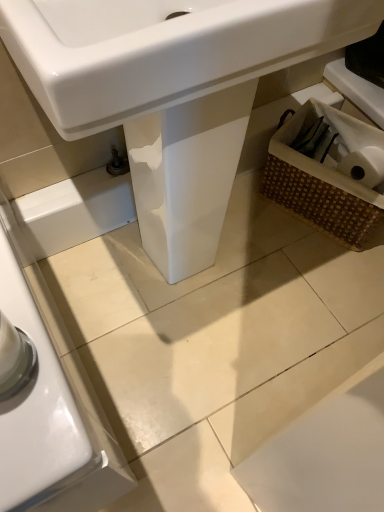
Where is `vacant space to the right of white glossy sink at center`? vacant space to the right of white glossy sink at center is located at coordinates (309, 283).